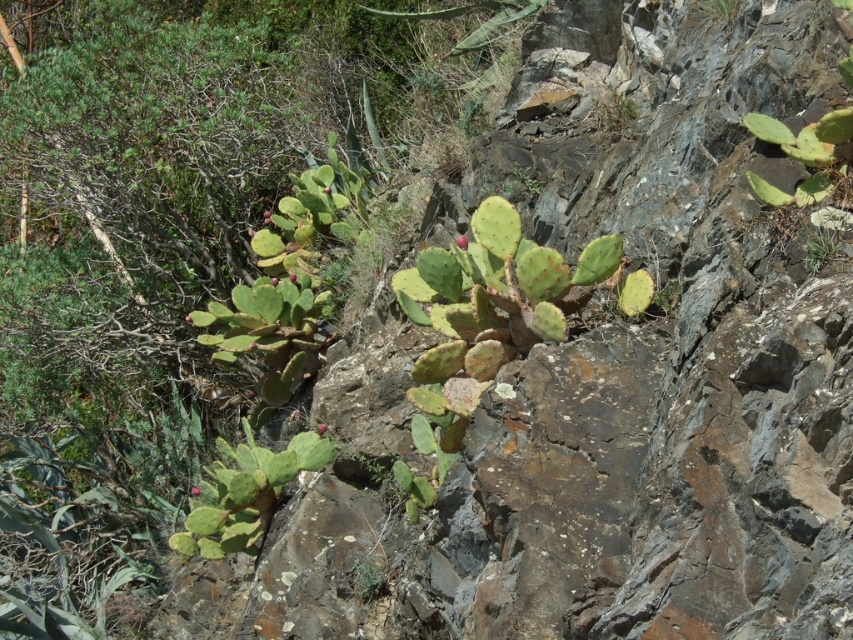
Does point (225, 515) come behind point (827, 250)?

Yes, it is behind point (827, 250).

Can you confirm if green spiny cactus at lower left is taller than green spiny cactus at upper right?

Indeed, green spiny cactus at lower left has a greater height compared to green spiny cactus at upper right.

At what (x,y) coordinates should I click in order to perform the action: click on green spiny cactus at lower left. Please return your answer as a coordinate pair (x, y). Image resolution: width=853 pixels, height=640 pixels. Looking at the image, I should click on click(244, 492).

This screenshot has width=853, height=640. I want to click on green spiny cactus at lower left, so click(244, 492).